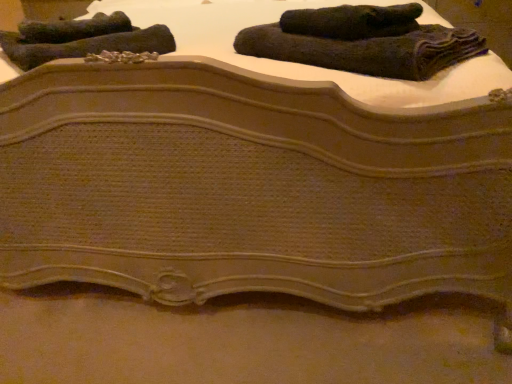
Question: In terms of width, does dark green textured towel at upper left, the second towel viewed from the left, look wider or thinner when compared to dark gray textured towel at upper left, which is counted as the fourth towel, starting from the right?

Choices:
 (A) thin
 (B) wide

Answer: (B)

Question: Looking at the image, does dark green textured towel at upper left, which ranks as the third towel in right-to-left order, seem bigger or smaller compared to dark gray textured towel at upper left, which is counted as the fourth towel, starting from the right?

Choices:
 (A) big
 (B) small

Answer: (A)

Question: Which object is positioned closest to the dark woolen towel at upper right, which appears as the third towel when viewed from the left?

Choices:
 (A) dark gray textured towel at upper left, which is counted as the fourth towel, starting from the right
 (B) dark woolen towel at upper center, which appears as the 1th towel when viewed from the right
 (C) dark green textured towel at upper left, which ranks as the third towel in right-to-left order

Answer: (B)

Question: Which object is positioned farthest from the dark woolen towel at upper center, which appears as the 1th towel when viewed from the right?

Choices:
 (A) dark woolen towel at upper right, which appears as the third towel when viewed from the left
 (B) dark gray textured towel at upper left, the first towel viewed from the left
 (C) dark green textured towel at upper left, the second towel viewed from the left

Answer: (B)